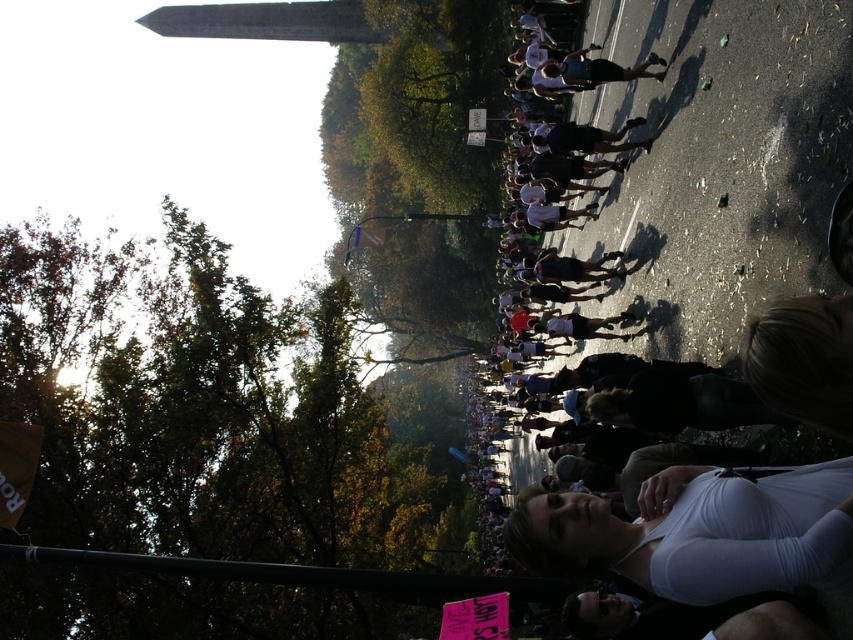
Question: Which point is closer to the camera?

Choices:
 (A) (625, 99)
 (B) (680, 560)

Answer: (B)

Question: Does dark clothing at center have a greater width compared to white matte shirt at lower right?

Choices:
 (A) no
 (B) yes

Answer: (A)

Question: Among these points, which one is nearest to the camera?

Choices:
 (A) (781, 516)
 (B) (560, 237)

Answer: (A)

Question: Where is dark clothing at center located in relation to white matte shirt at lower right in the image?

Choices:
 (A) above
 (B) below

Answer: (A)

Question: Is dark clothing at center smaller than white matte shirt at lower right?

Choices:
 (A) no
 (B) yes

Answer: (A)